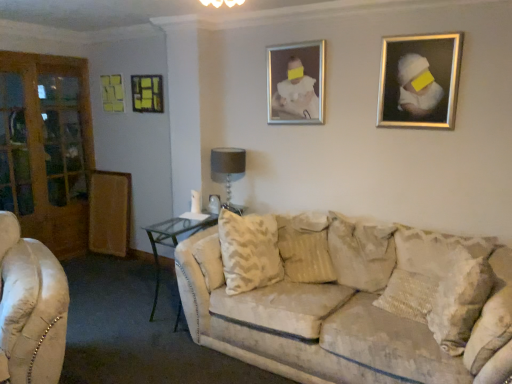
You are a GUI agent. You are given a task and a screenshot of the screen. Output one action in this format:
    pyautogui.click(x=<x>, y=<y>)
    Task: Click on the blank space situated above silver metallic picture frame at upper right, the 1th picture frame positioned from the front (from a real-world perspective)
    Image resolution: width=512 pixels, height=384 pixels.
    Given the screenshot: What is the action you would take?
    pyautogui.click(x=412, y=29)